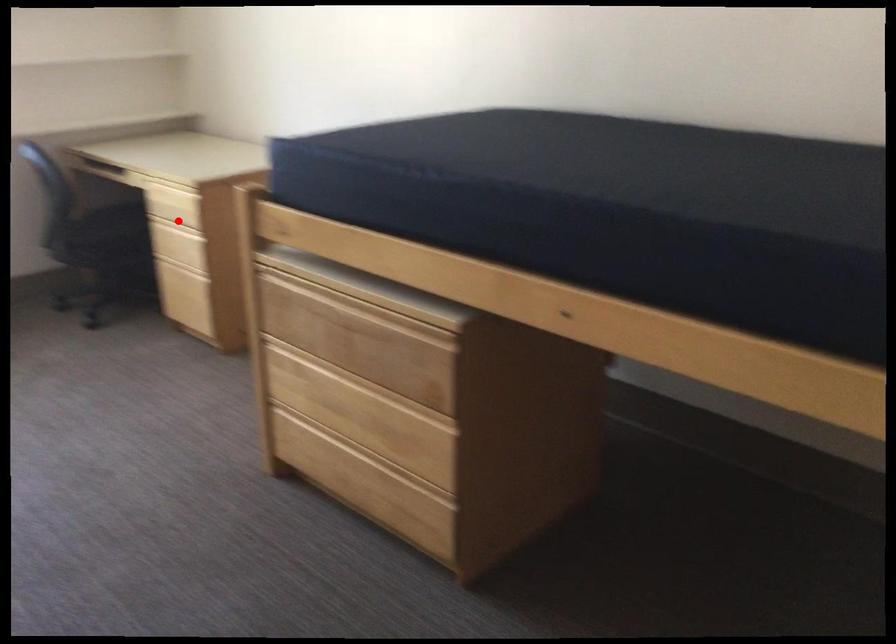
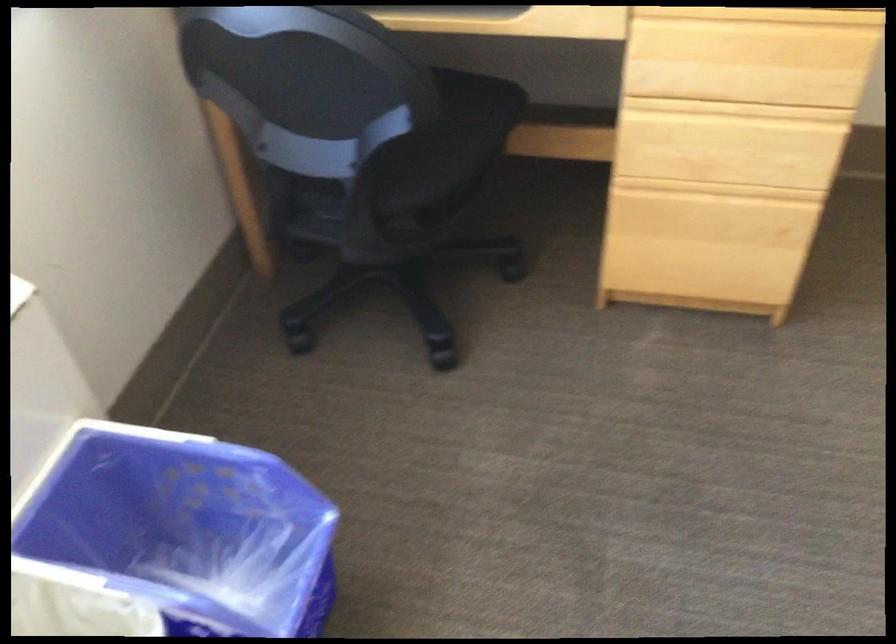
Question: I am providing you with two images of the same scene from different viewpoints. Given a red point in image1, look at the same physical point in image2. Is it:

Choices:
 (A) Closer to the viewpoint
 (B) Farther from the viewpoint

Answer: (A)